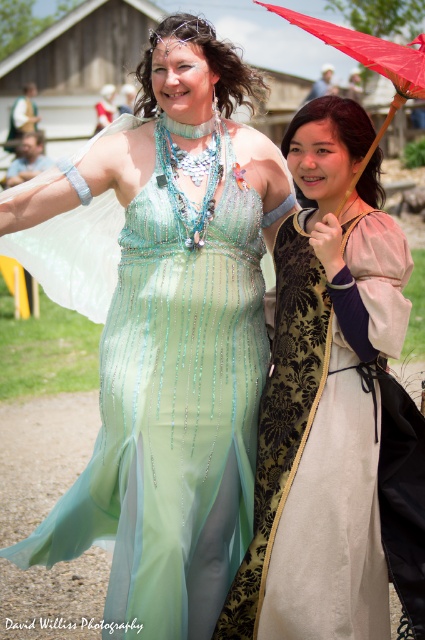
Who is lower down, light green sheer dress at center or velvet gold dress at center?

light green sheer dress at center is below.

Is light green sheer dress at center to the right of velvet gold dress at center from the viewer's perspective?

No, light green sheer dress at center is not to the right of velvet gold dress at center.

Between point (96, 256) and point (275, 403), which one is positioned in front?

Point (275, 403)

I want to click on light green sheer dress at center, so (158, 384).

Between velvet gold dress at center and red fabric umbrella at upper right, which one appears on the right side from the viewer's perspective?

From the viewer's perspective, red fabric umbrella at upper right appears more on the right side.

The image size is (425, 640). I want to click on velvet gold dress at center, so click(x=326, y=403).

Between point (291, 625) and point (422, 92), which one is positioned behind?

Positioned behind is point (291, 625).

The height and width of the screenshot is (640, 425). I want to click on velvet gold dress at center, so point(326,403).

What do you see at coordinates (158, 384) in the screenshot?
I see `light green sheer dress at center` at bounding box center [158, 384].

Does light green sheer dress at center have a lesser width compared to red fabric umbrella at upper right?

Correct, light green sheer dress at center's width is less than red fabric umbrella at upper right's.

Is point (226, 390) less distant than point (345, 35)?

No, (226, 390) is behind (345, 35).

This screenshot has width=425, height=640. In order to click on light green sheer dress at center in this screenshot , I will do `click(158, 384)`.